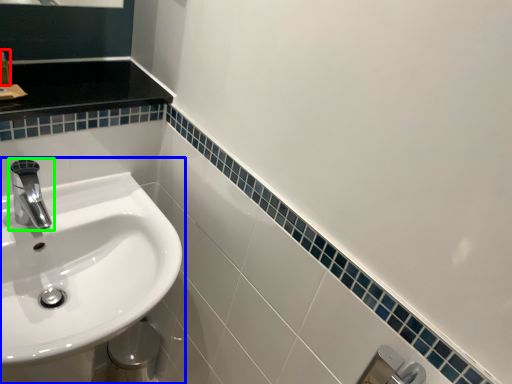
Question: Estimate the real-world distances between objects in this image. Which object is farther from toiletry (highlighted by a red box), sink (highlighted by a blue box) or tap (highlighted by a green box)?

Choices:
 (A) sink
 (B) tap

Answer: (A)